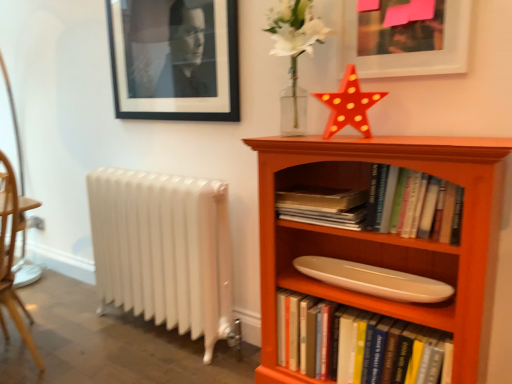
Identify the location of vacant area that lies to the right of wooden chair at left. The height and width of the screenshot is (384, 512). (62, 318).